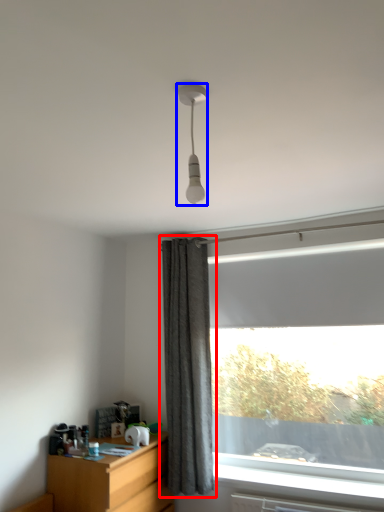
Question: Which object appears closest to the camera in this image, curtain (highlighted by a red box) or lamp (highlighted by a blue box)?

Choices:
 (A) curtain
 (B) lamp

Answer: (B)